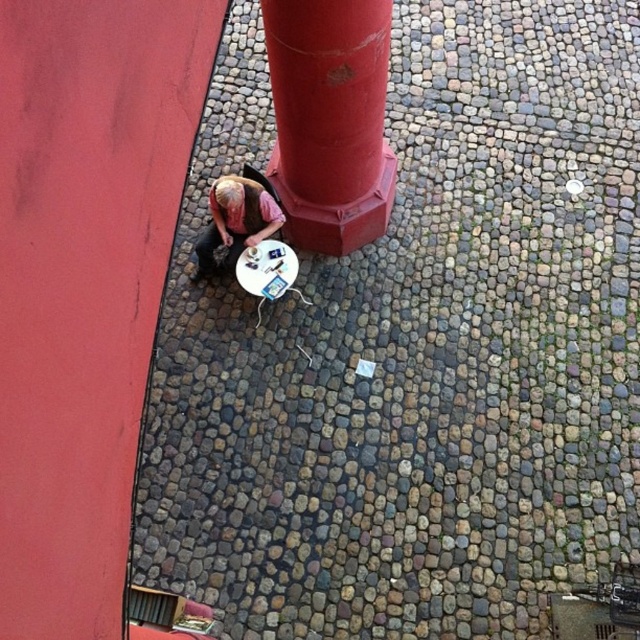
Locate an element on the screen. smooth red pillar at center is located at coordinates (330, 120).

Who is shorter, smooth red pillar at center or matte pink shirt at center?

Standing shorter between the two is matte pink shirt at center.

The image size is (640, 640). What are the coordinates of `smooth red pillar at center` in the screenshot? It's located at (330, 120).

Where is `smooth red pillar at center`? The image size is (640, 640). smooth red pillar at center is located at coordinates 330,120.